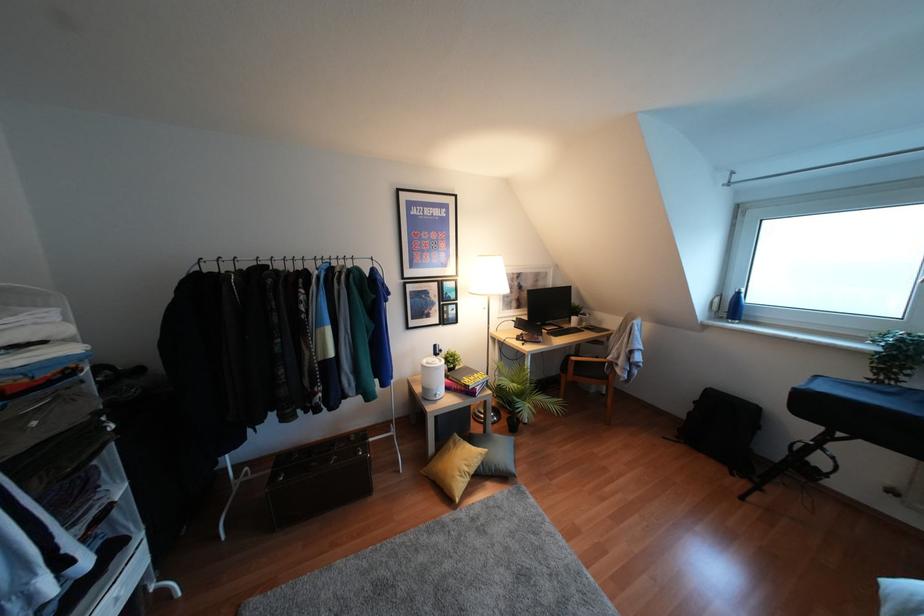
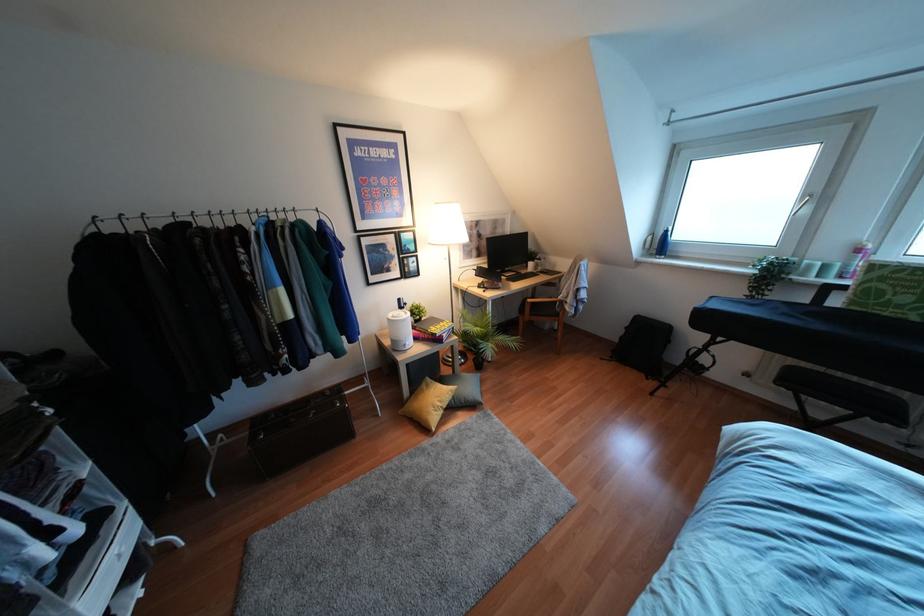
In the second image, find the point that corresponds to (481,463) in the first image.

(453, 397)